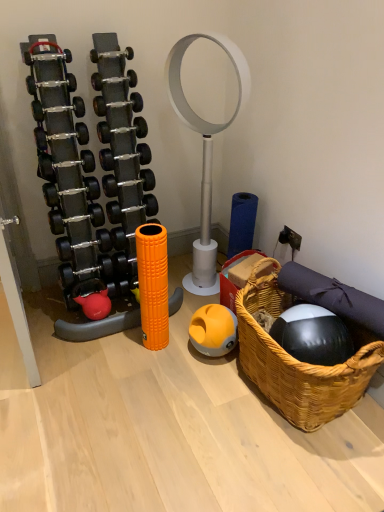
Question: Should I look upward or downward to see matte black dumbbell at center?

Choices:
 (A) down
 (B) up

Answer: (B)

Question: Is rubberized red kettlebell at lower left facing towards orange rubber ball at center?

Choices:
 (A) no
 (B) yes

Answer: (A)

Question: Can you confirm if rubberized red kettlebell at lower left is positioned to the left of orange rubber ball at center?

Choices:
 (A) yes
 (B) no

Answer: (A)

Question: From the image's perspective, does rubberized red kettlebell at lower left appear lower than orange rubber ball at center?

Choices:
 (A) no
 (B) yes

Answer: (A)

Question: Is the depth of rubberized red kettlebell at lower left greater than that of orange rubber ball at center?

Choices:
 (A) yes
 (B) no

Answer: (A)

Question: Is rubberized red kettlebell at lower left outside of orange rubber ball at center?

Choices:
 (A) yes
 (B) no

Answer: (A)

Question: From a real-world perspective, is rubberized red kettlebell at lower left beneath orange rubber ball at center?

Choices:
 (A) no
 (B) yes

Answer: (A)

Question: Is rubberized red kettlebell at lower left surrounded by woven brown basket at lower right?

Choices:
 (A) yes
 (B) no

Answer: (B)

Question: Is woven brown basket at lower right not within rubberized red kettlebell at lower left?

Choices:
 (A) no
 (B) yes

Answer: (B)

Question: Can you confirm if woven brown basket at lower right is shorter than rubberized red kettlebell at lower left?

Choices:
 (A) no
 (B) yes

Answer: (A)

Question: Is woven brown basket at lower right to the left of rubberized red kettlebell at lower left from the viewer's perspective?

Choices:
 (A) yes
 (B) no

Answer: (B)

Question: Is woven brown basket at lower right smaller than rubberized red kettlebell at lower left?

Choices:
 (A) no
 (B) yes

Answer: (A)

Question: Is woven brown basket at lower right in front of rubberized red kettlebell at lower left?

Choices:
 (A) no
 (B) yes

Answer: (B)

Question: Considering the relative positions of orange rubber ball at center and rubberized red kettlebell at lower left in the image provided, is orange rubber ball at center to the left of rubberized red kettlebell at lower left from the viewer's perspective?

Choices:
 (A) no
 (B) yes

Answer: (A)